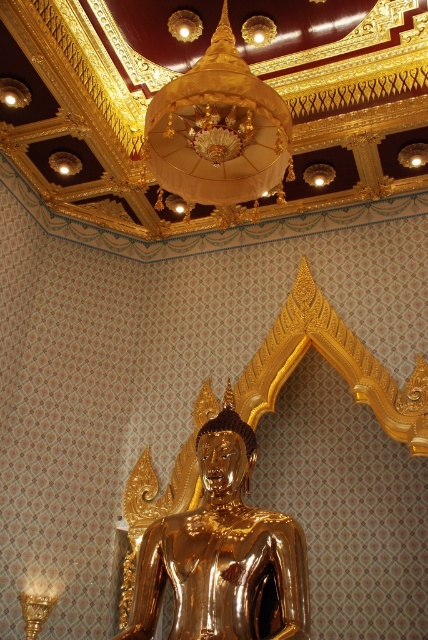
Question: From the image, what is the correct spatial relationship of gold metallic statue at center in relation to gold silk chandelier at upper center?

Choices:
 (A) left
 (B) right

Answer: (A)

Question: Where is gold metallic statue at center located in relation to gold silk chandelier at upper center in the image?

Choices:
 (A) below
 (B) above

Answer: (A)

Question: Which point is farther to the camera?

Choices:
 (A) gold metallic statue at center
 (B) gold silk chandelier at upper center

Answer: (B)

Question: Does gold metallic statue at center come behind gold silk chandelier at upper center?

Choices:
 (A) yes
 (B) no

Answer: (B)

Question: Which point is farther from the camera taking this photo?

Choices:
 (A) (184, 81)
 (B) (222, 589)

Answer: (A)